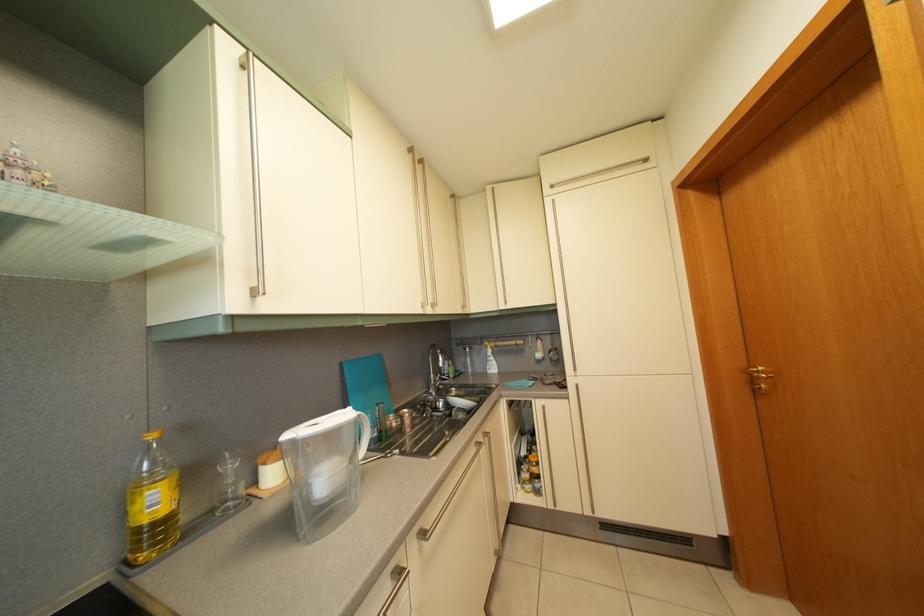
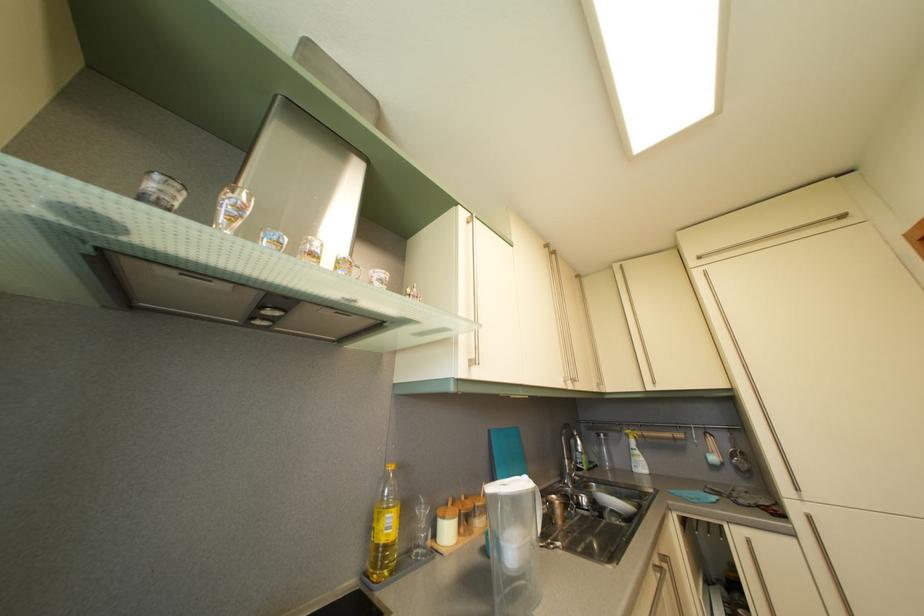
Locate, in the second image, the point that corresponds to pixel 473 357 in the first image.

(608, 444)